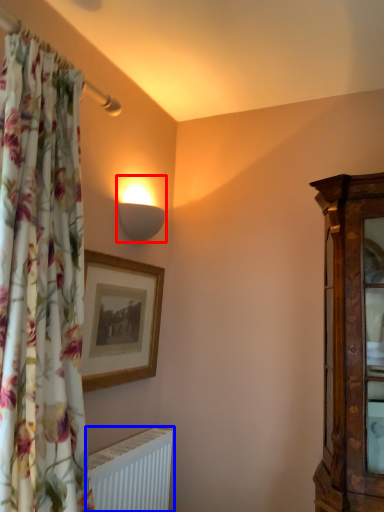
Question: Which point is further to the camera, lamp (highlighted by a red box) or radiator (highlighted by a blue box)?

Choices:
 (A) lamp
 (B) radiator

Answer: (A)